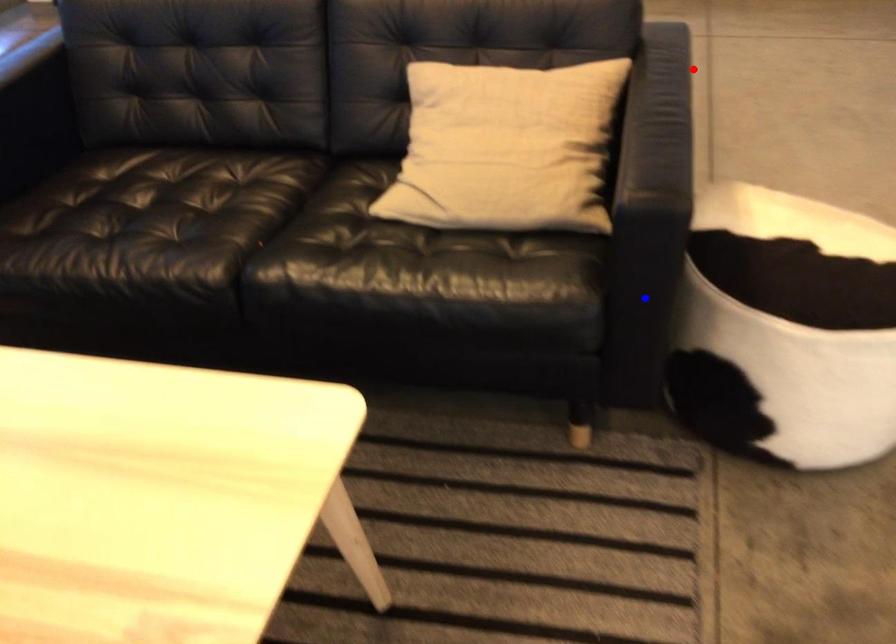
Question: Two points are marked on the image. Which point is closer to the camera?

Choices:
 (A) Blue point is closer.
 (B) Red point is closer.

Answer: (A)